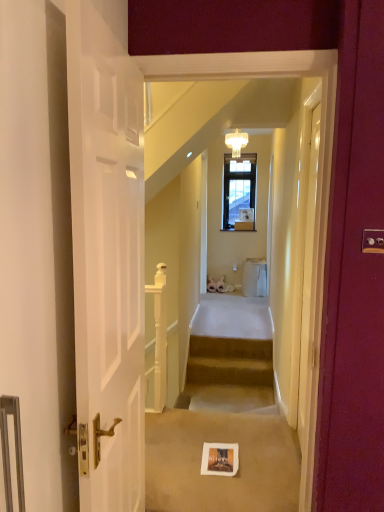
Question: Considering the positions of clear glass chandelier at upper center and white matte door at left, which is counted as the 1th door, starting from the left, in the image, is clear glass chandelier at upper center bigger or smaller than white matte door at left, which is counted as the 1th door, starting from the left,?

Choices:
 (A) big
 (B) small

Answer: (B)

Question: From the image's perspective, is clear glass chandelier at upper center located above or below white matte door at left, the 1th door viewed from the front?

Choices:
 (A) above
 (B) below

Answer: (A)

Question: Based on their relative distances, which object is nearer to the beige carpeted stairs at center?

Choices:
 (A) white glossy door at upper center, the first door from the right
 (B) white matte door at left, the 1th door viewed from the front
 (C) clear glass chandelier at upper center
 (D) white glossy balustrade at center

Answer: (D)

Question: Estimate the real-world distances between objects in this image. Which object is closer to the clear glass chandelier at upper center?

Choices:
 (A) white glossy balustrade at center
 (B) white glossy door at upper center, the second door positioned from the left
 (C) beige carpeted stairs at center
 (D) white matte door at left, the 1th door viewed from the front

Answer: (A)